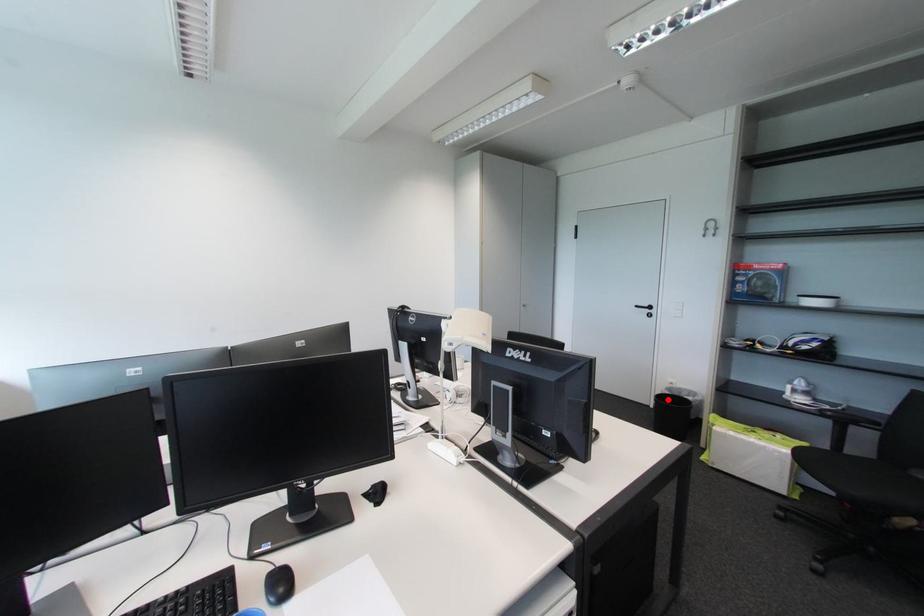
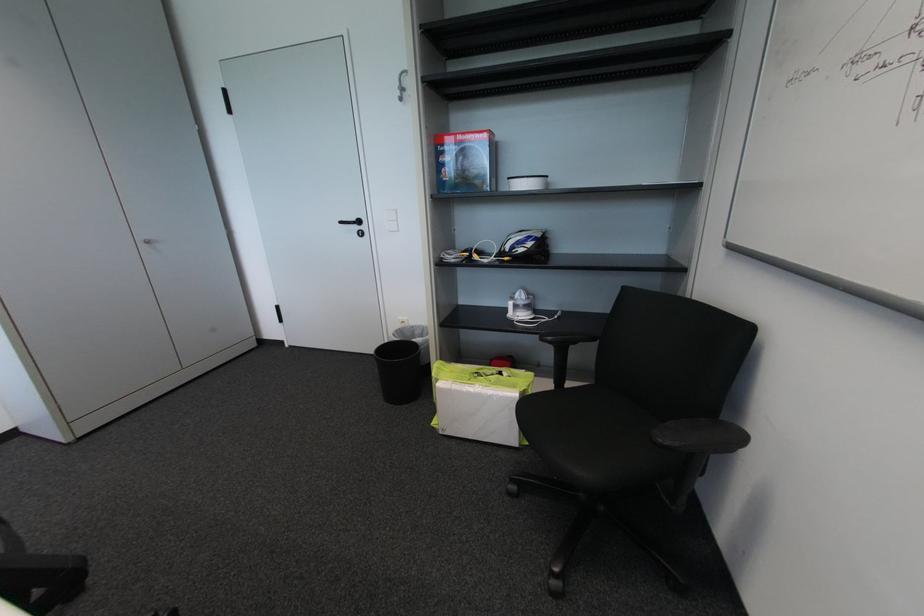
The point at the highlighted location is marked in the first image. Where is the corresponding point in the second image?

(392, 351)